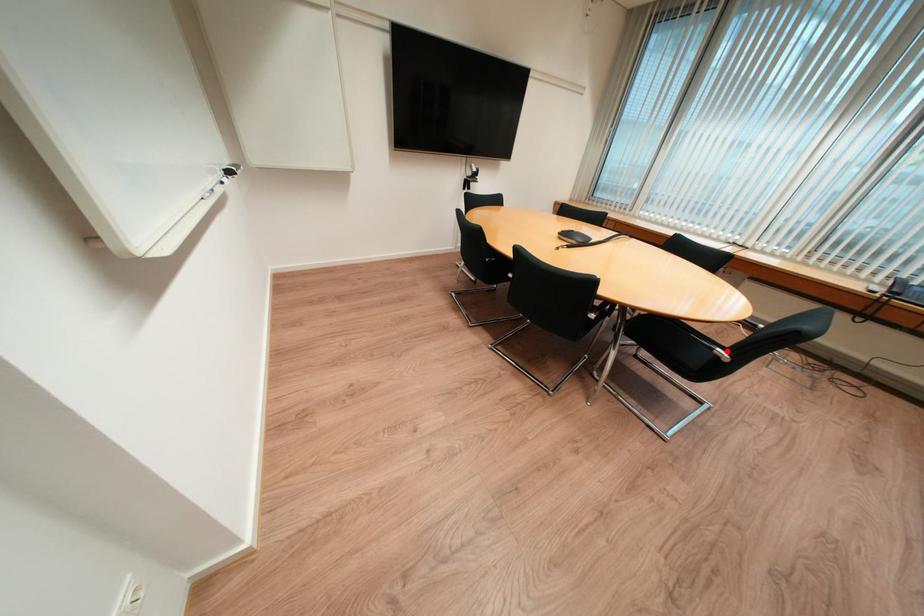
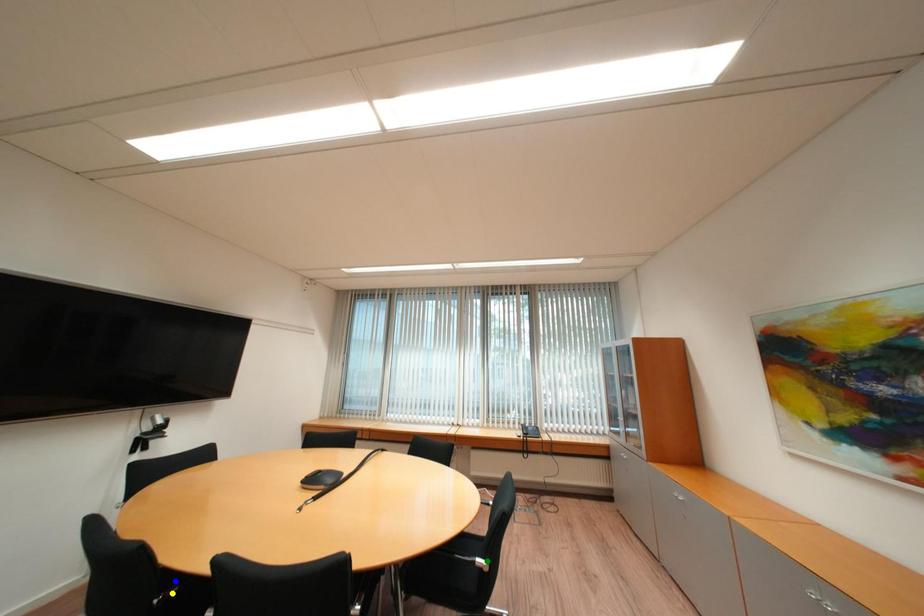
Question: I am providing you with two images of the same scene from different viewpoints. A red point is marked on the first image. You are given multiple points on the second image. Can you choose the point in image 2 that corresponds to the point in image 1?

Choices:
 (A) green point
 (B) yellow point
 (C) blue point

Answer: (A)